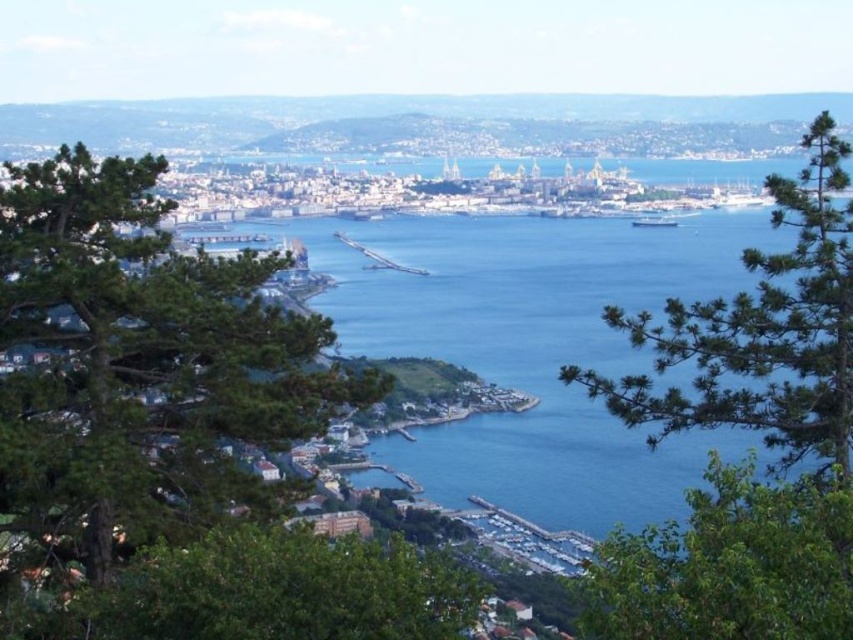
Between green leafy tree at left and green leafy tree at lower center, which one appears on the right side from the viewer's perspective?

From the viewer's perspective, green leafy tree at lower center appears more on the right side.

Does green leafy tree at left come in front of green leafy tree at lower center?

Yes, it is.

Who is more distant from viewer, [181,442] or [114,632]?

Positioned behind is point [181,442].

Image resolution: width=853 pixels, height=640 pixels. Find the location of `green leafy tree at left`. green leafy tree at left is located at coordinates (141, 365).

Can you confirm if green leafy tree at left is positioned below blue water at center?

Yes, green leafy tree at left is below blue water at center.

Does green leafy tree at left appear on the right side of blue water at center?

No, green leafy tree at left is not to the right of blue water at center.

Does point (207, 333) lie behind point (370, 269)?

That is True.

The height and width of the screenshot is (640, 853). I want to click on green leafy tree at left, so [x=141, y=365].

Is green leafy tree at lower center smaller than green leafy tree at lower right?

Yes.

Is point (83, 593) behind point (699, 545)?

No, it is in front of (699, 545).

The image size is (853, 640). What are the coordinates of `green leafy tree at lower center` in the screenshot? It's located at (264, 593).